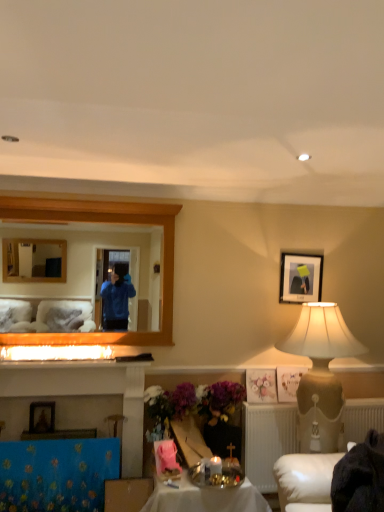
Question: From a real-world perspective, is shiny metallic tray at center positioned above or below wooden picture frame at lower left, placed as the first picture frame when sorted from left to right?

Choices:
 (A) above
 (B) below

Answer: (B)

Question: From the image's perspective, is shiny metallic tray at center located above or below wooden picture frame at lower left, the first picture frame when ordered from bottom to top?

Choices:
 (A) above
 (B) below

Answer: (B)

Question: Which is farther from the wooden frame mirror at upper left?

Choices:
 (A) white textured radiator at lower right
 (B) matte black picture frame at upper right, acting as the 1th picture frame starting from the back
 (C) shiny metallic tray at center
 (D) wooden picture frame at lower left, the 2th picture frame in the top-to-bottom sequence
 (E) pastel floral print at center

Answer: (E)

Question: Estimate the real-world distances between objects in this image. Which object is farther from the beige textured lampshade at right?

Choices:
 (A) wooden picture frame at lower left, the 2th picture frame in the top-to-bottom sequence
 (B) blue fabric tablecloth at lower left
 (C) pastel floral print at center
 (D) shiny metallic tray at center
 (E) wooden frame mirror at upper left

Answer: (A)